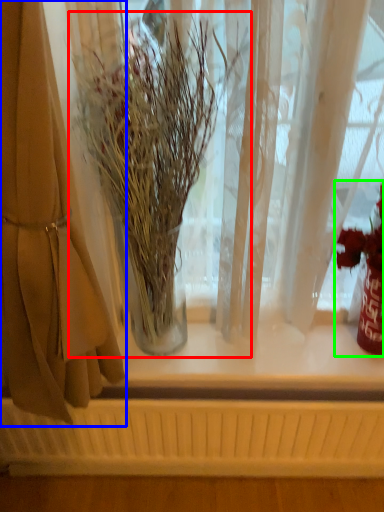
Question: Estimate the real-world distances between objects in this image. Which object is farther from houseplant (highlighted by a red box), curtain (highlighted by a blue box) or floral arrangement (highlighted by a green box)?

Choices:
 (A) curtain
 (B) floral arrangement

Answer: (B)